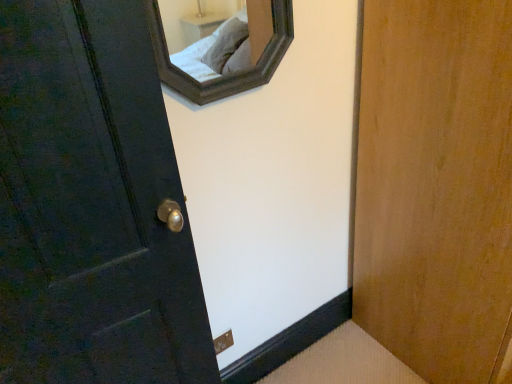
Question: In terms of height, does matte dark wood door at left look taller or shorter compared to brown matte electric outlet at lower center?

Choices:
 (A) short
 (B) tall

Answer: (B)

Question: Considering the positions of matte dark wood door at left and brown matte electric outlet at lower center in the image, is matte dark wood door at left wider or thinner than brown matte electric outlet at lower center?

Choices:
 (A) wide
 (B) thin

Answer: (A)

Question: In the image, is matte dark wood door at left positioned in front of or behind brown matte electric outlet at lower center?

Choices:
 (A) front
 (B) behind

Answer: (A)

Question: From the image's perspective, relative to matte dark wood door at left, is brown matte electric outlet at lower center above or below?

Choices:
 (A) above
 (B) below

Answer: (B)

Question: Considering the positions of brown matte electric outlet at lower center and matte dark wood door at left in the image, is brown matte electric outlet at lower center taller or shorter than matte dark wood door at left?

Choices:
 (A) tall
 (B) short

Answer: (B)

Question: From a real-world perspective, relative to matte dark wood door at left, is brown matte electric outlet at lower center vertically above or below?

Choices:
 (A) below
 (B) above

Answer: (A)

Question: Choose the correct answer: Is brown matte electric outlet at lower center inside matte dark wood door at left or outside it?

Choices:
 (A) inside
 (B) outside

Answer: (B)